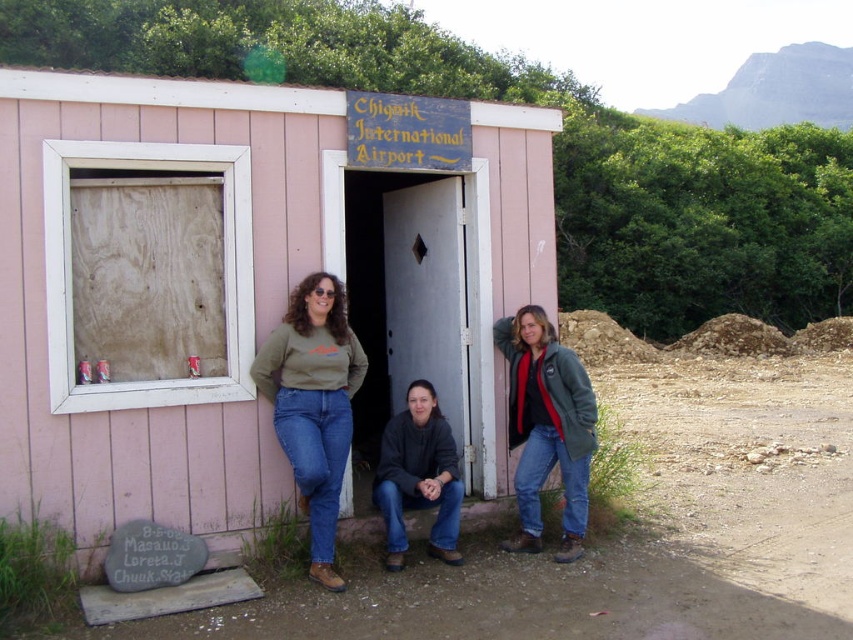
Which is behind, point (215, 360) or point (508, 433)?

Point (508, 433)

Based on the photo, is pink wood hut at center taller than green fleece jacket at right?

Yes, pink wood hut at center is taller than green fleece jacket at right.

What do you see at coordinates (248, 284) in the screenshot?
I see `pink wood hut at center` at bounding box center [248, 284].

The image size is (853, 640). In order to click on pink wood hut at center in this screenshot , I will do `click(248, 284)`.

Looking at this image, is pink wood hut at center below matte green sweater at center?

Actually, pink wood hut at center is above matte green sweater at center.

Is pink wood hut at center shorter than matte green sweater at center?

No.

What do you see at coordinates (248, 284) in the screenshot? Image resolution: width=853 pixels, height=640 pixels. I see `pink wood hut at center` at bounding box center [248, 284].

Identify the location of pink wood hut at center. The width and height of the screenshot is (853, 640). (248, 284).

Between jeans at center and green fleece jacket at right, which one is positioned higher?

jeans at center is higher up.

Between jeans at center and green fleece jacket at right, which one appears on the right side from the viewer's perspective?

Positioned to the right is green fleece jacket at right.

Measure the distance between jeans at center and camera.

The distance of jeans at center from camera is 4.49 meters.

I want to click on jeans at center, so click(x=312, y=403).